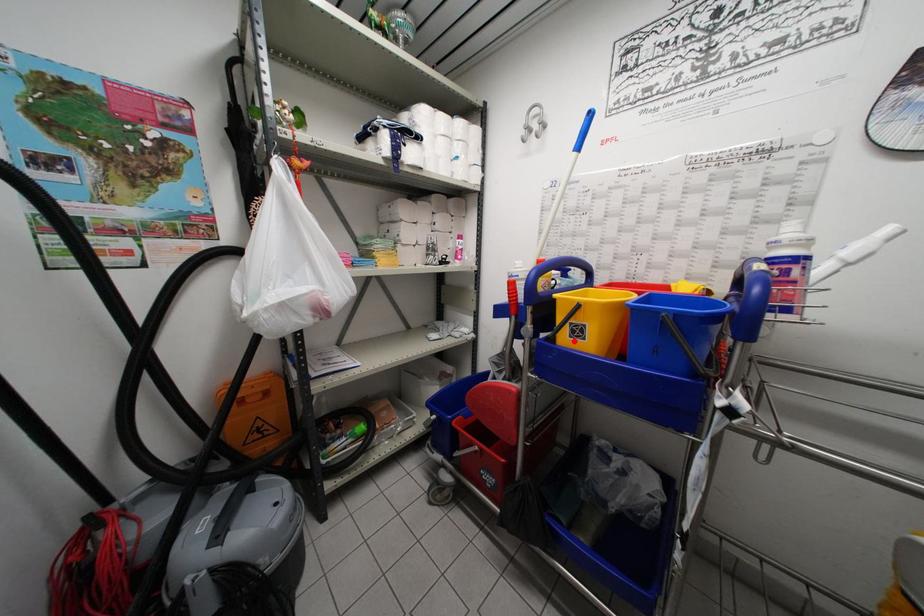
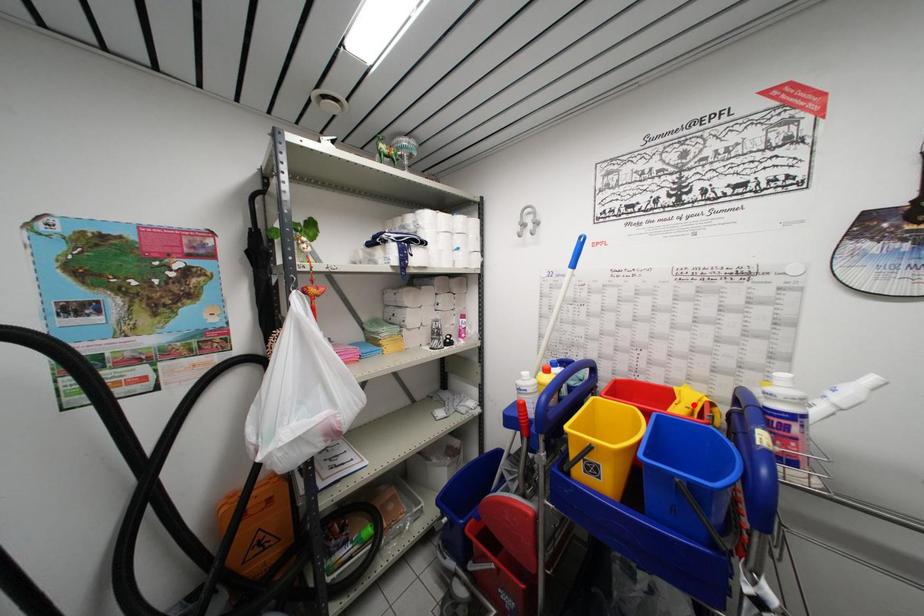
I am providing you with two images of the same scene from different viewpoints. A red point is marked on the first image and another point is marked on the second image. Is the marked point in image1 the same physical position as the marked point in image2?

No